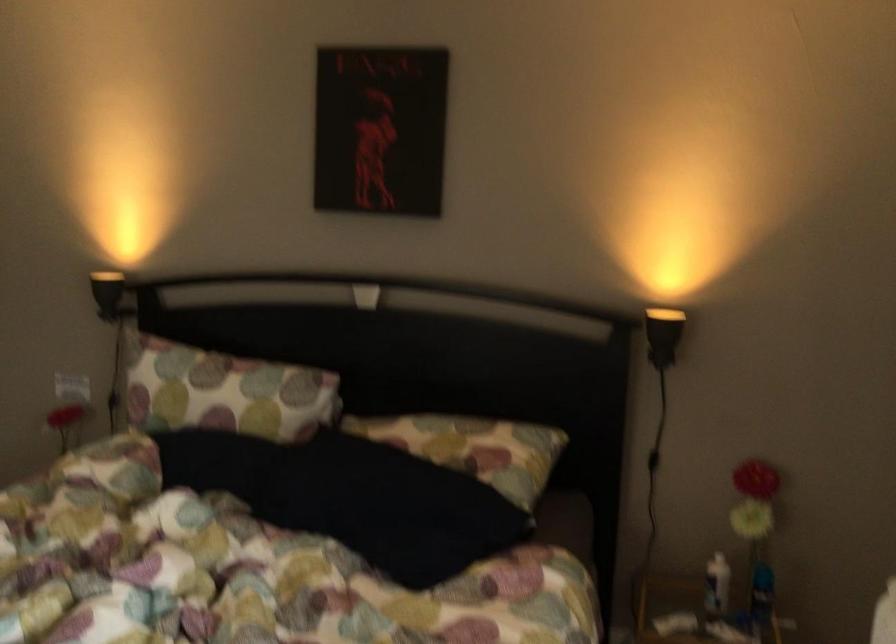
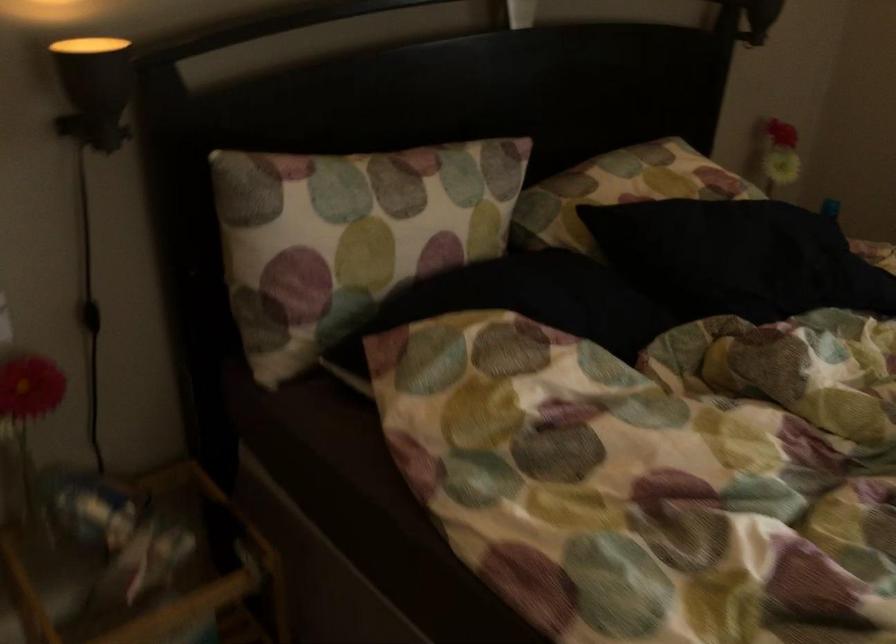
Locate, in the second image, the point that corresponds to [319,480] in the first image.

(737, 258)